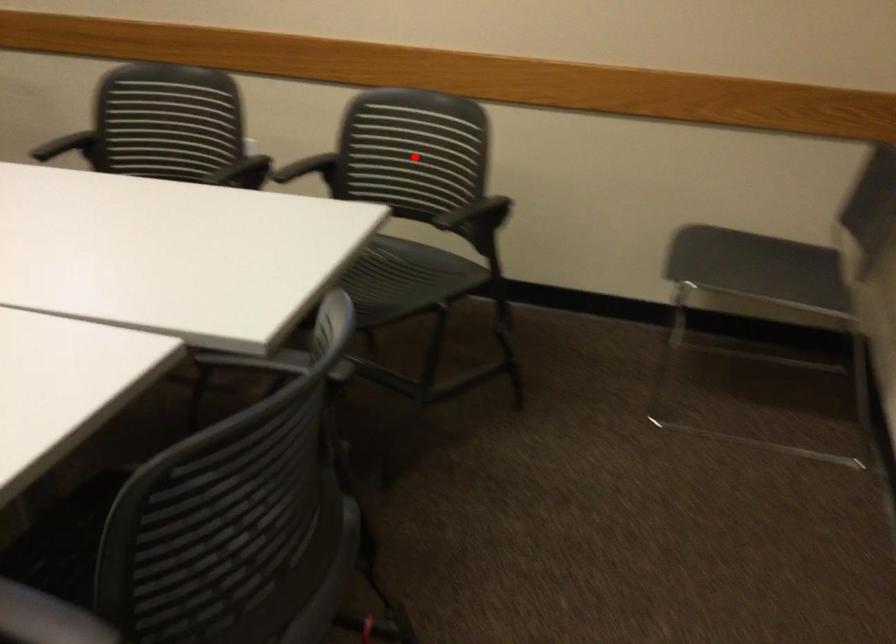
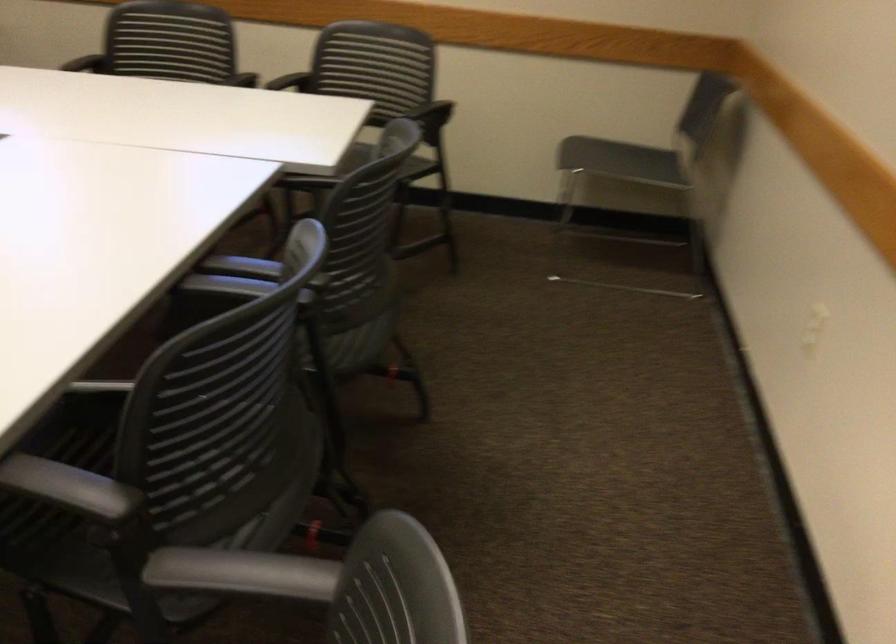
Question: I am providing you with two images of the same scene from different viewpoints. Given a red point in image1, look at the same physical point in image2. Is it:

Choices:
 (A) Closer to the viewpoint
 (B) Farther from the viewpoint

Answer: (B)